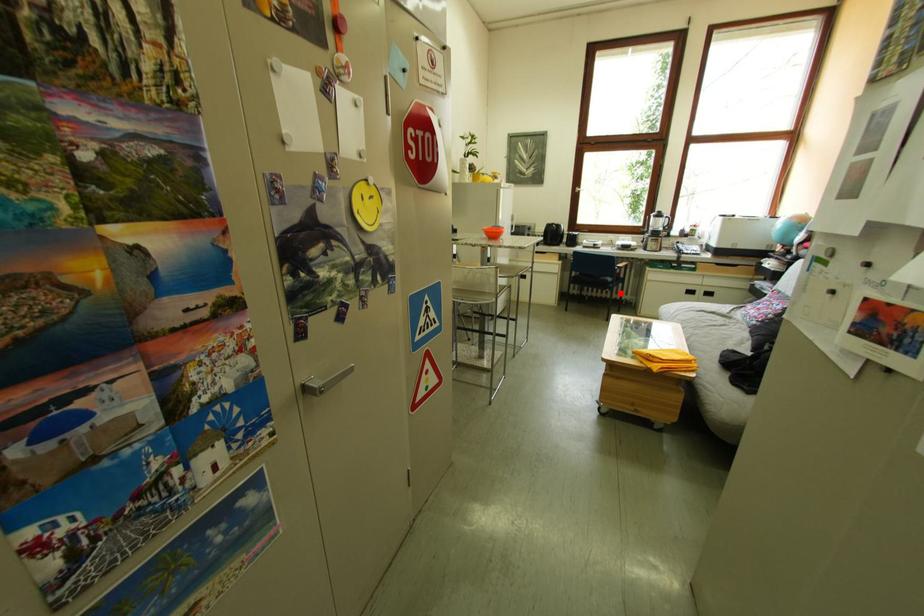
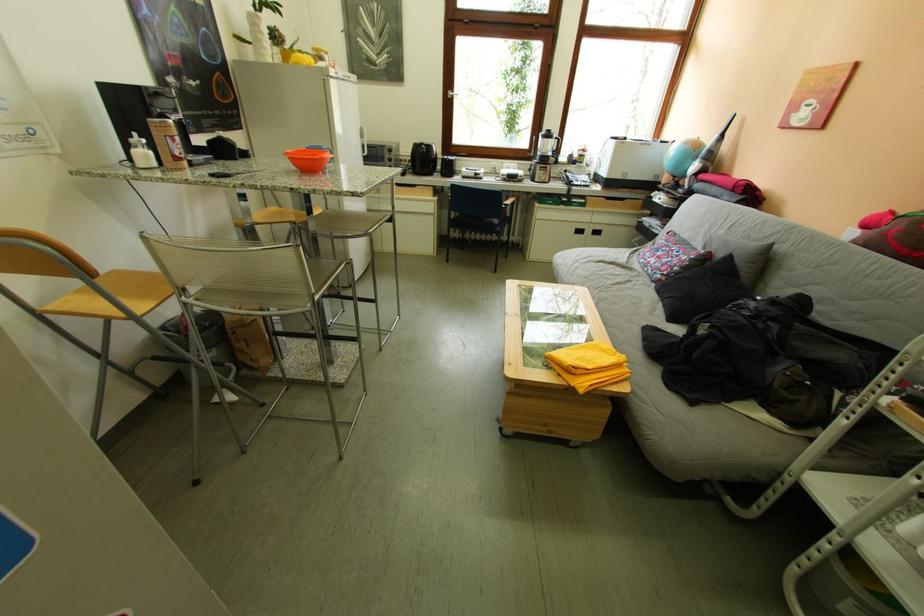
Question: I am providing you with two images of the same scene from different viewpoints. Image1 has a red point marked. In image2, the corresponding 3D location appears at what relative position? Reply with the corresponding letter.

Choices:
 (A) Closer
 (B) Farther

Answer: (A)